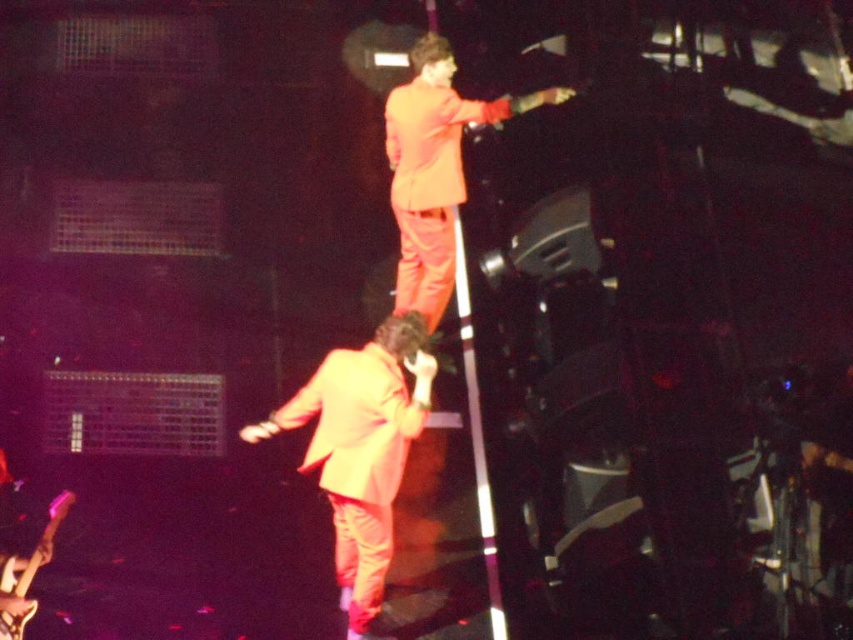
Is the position of orange matte suit at center more distant than that of orange matte suit at upper center?

No, it is not.

Can you confirm if orange matte suit at center is wider than orange matte suit at upper center?

No, orange matte suit at center is not wider than orange matte suit at upper center.

Locate an element on the screen. The image size is (853, 640). orange matte suit at center is located at coordinates (361, 449).

Find the location of a particular element. This screenshot has height=640, width=853. orange matte suit at center is located at coordinates (361, 449).